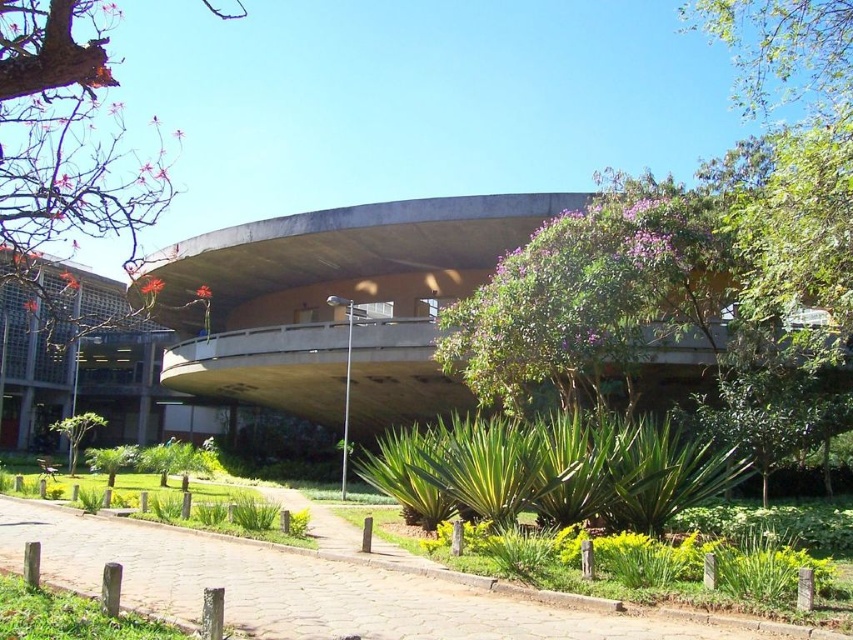
Consider the image. Is brown cobblestone path at center to the right of green leafy tree at lower left from the viewer's perspective?

Indeed, brown cobblestone path at center is positioned on the right side of green leafy tree at lower left.

Identify the location of brown cobblestone path at center. (312, 586).

You are a GUI agent. You are given a task and a screenshot of the screen. Output one action in this format:
    pyautogui.click(x=<x>, y=<y>)
    Task: Click on the brown cobblestone path at center
    The width and height of the screenshot is (853, 640).
    Given the screenshot: What is the action you would take?
    pyautogui.click(x=312, y=586)

Which is above, purple leafy tree at center or green leafy tree at lower left?

purple leafy tree at center is above.

Which is more to the right, purple leafy tree at center or green leafy tree at lower left?

purple leafy tree at center

The image size is (853, 640). Find the location of `purple leafy tree at center`. purple leafy tree at center is located at coordinates (590, 298).

Between purple leafy tree at center and smooth bark tree at left, which one appears on the right side from the viewer's perspective?

From the viewer's perspective, purple leafy tree at center appears more on the right side.

Between purple leafy tree at center and smooth bark tree at left, which one appears on the left side from the viewer's perspective?

Positioned to the left is smooth bark tree at left.

Where is `purple leafy tree at center`? The height and width of the screenshot is (640, 853). purple leafy tree at center is located at coordinates (590, 298).